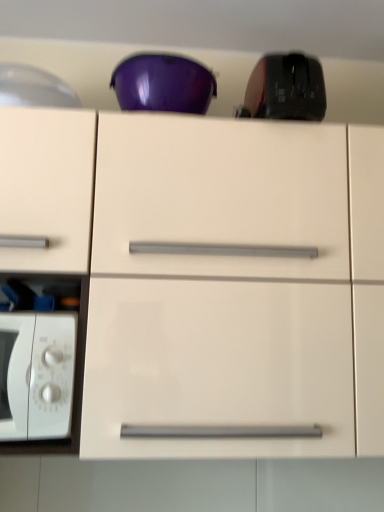
Question: Does white glossy microwave oven at left have a greater height compared to black matte mouse at upper right?

Choices:
 (A) yes
 (B) no

Answer: (A)

Question: Is white glossy microwave oven at left touching black matte mouse at upper right?

Choices:
 (A) yes
 (B) no

Answer: (B)

Question: Is white glossy microwave oven at left smaller than black matte mouse at upper right?

Choices:
 (A) yes
 (B) no

Answer: (B)

Question: Is black matte mouse at upper right a part of white glossy microwave oven at left?

Choices:
 (A) yes
 (B) no

Answer: (B)

Question: Could you tell me if white glossy microwave oven at left is facing black matte mouse at upper right?

Choices:
 (A) yes
 (B) no

Answer: (B)

Question: From a real-world perspective, is white glossy microwave oven at left physically above black matte mouse at upper right?

Choices:
 (A) yes
 (B) no

Answer: (B)

Question: Considering the relative sizes of glossy white cabinet at center and black matte mouse at upper right in the image provided, is glossy white cabinet at center bigger than black matte mouse at upper right?

Choices:
 (A) no
 (B) yes

Answer: (B)

Question: Does glossy white cabinet at center have a smaller size compared to black matte mouse at upper right?

Choices:
 (A) yes
 (B) no

Answer: (B)

Question: Is black matte mouse at upper right at the back of glossy white cabinet at center?

Choices:
 (A) no
 (B) yes

Answer: (A)

Question: From the image's perspective, is glossy white cabinet at center under black matte mouse at upper right?

Choices:
 (A) no
 (B) yes

Answer: (B)

Question: From a real-world perspective, is glossy white cabinet at center physically above black matte mouse at upper right?

Choices:
 (A) yes
 (B) no

Answer: (B)

Question: Could you tell me if glossy white cabinet at center is turned towards black matte mouse at upper right?

Choices:
 (A) no
 (B) yes

Answer: (A)

Question: Can you confirm if white glossy microwave oven at left is taller than glossy white cabinet at center?

Choices:
 (A) no
 (B) yes

Answer: (A)